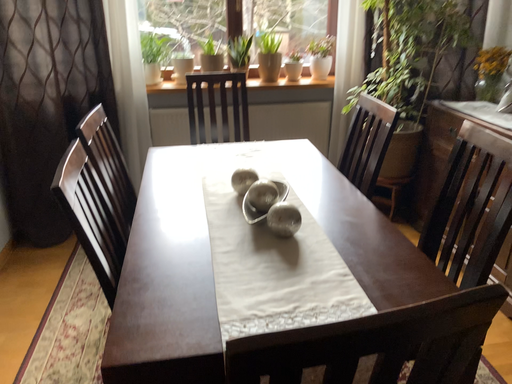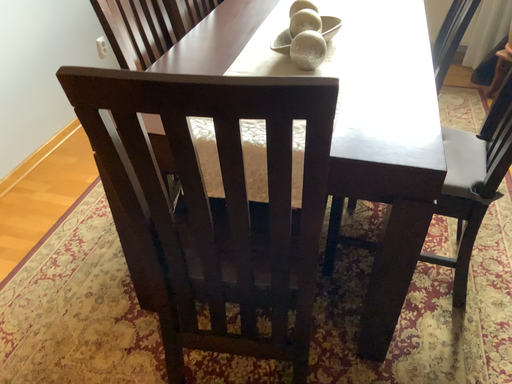
Question: How did the camera likely rotate when shooting the video?

Choices:
 (A) rotated right
 (B) rotated left

Answer: (B)